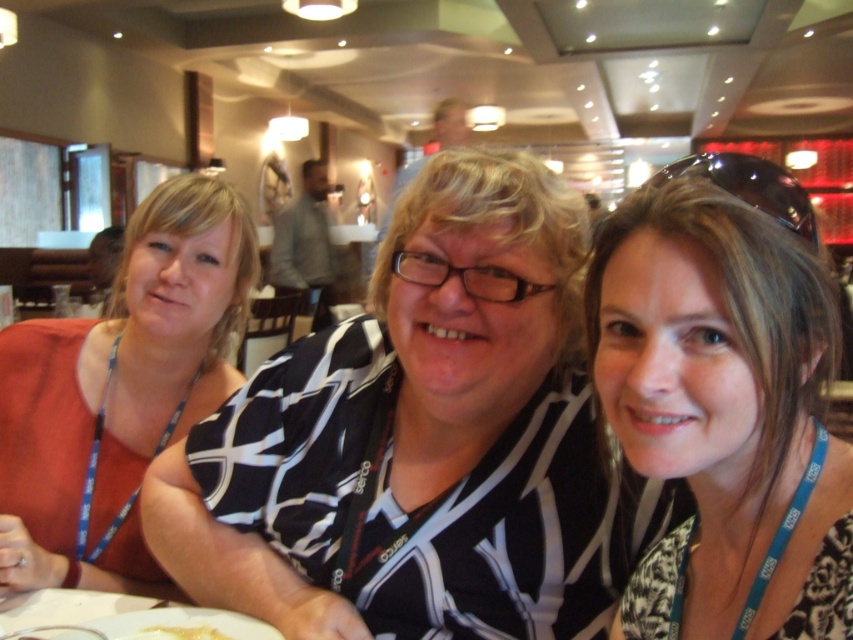
Is black and white striped shirt at center above white creamy food at lower left?

Yes, black and white striped shirt at center is above white creamy food at lower left.

Does black and white striped shirt at center have a smaller size compared to white creamy food at lower left?

No.

Measure the distance between point [451,200] and camera.

Point [451,200] and camera are 81.20 centimeters apart.

Locate an element on the screen. black and white striped shirt at center is located at coordinates (422, 442).

Is gray cotton shirt at center behind white creamy food at lower left?

That is True.

Can you confirm if gray cotton shirt at center is thinner than white creamy food at lower left?

No.

Which is in front, point (300, 266) or point (167, 628)?

Point (167, 628) is in front.

Image resolution: width=853 pixels, height=640 pixels. I want to click on gray cotton shirt at center, so pyautogui.click(x=305, y=243).

Is matte black shirt at center above gray cotton shirt at center?

Incorrect, matte black shirt at center is not positioned above gray cotton shirt at center.

Is matte black shirt at center further to camera compared to gray cotton shirt at center?

No.

Does point (815, 310) come closer to viewer compared to point (299, 280)?

Yes, point (815, 310) is closer to viewer.

Where is `matte black shirt at center`? matte black shirt at center is located at coordinates (724, 400).